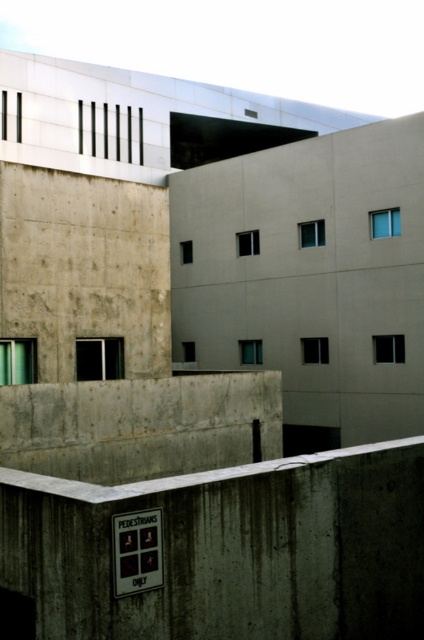
Does gray concrete wall at lower center appear on the right side of concrete ledge at lower center?

No, gray concrete wall at lower center is not to the right of concrete ledge at lower center.

Is gray concrete wall at lower center above concrete ledge at lower center?

Yes, gray concrete wall at lower center is above concrete ledge at lower center.

In order to click on gray concrete wall at lower center in this screenshot , I will do `click(223, 550)`.